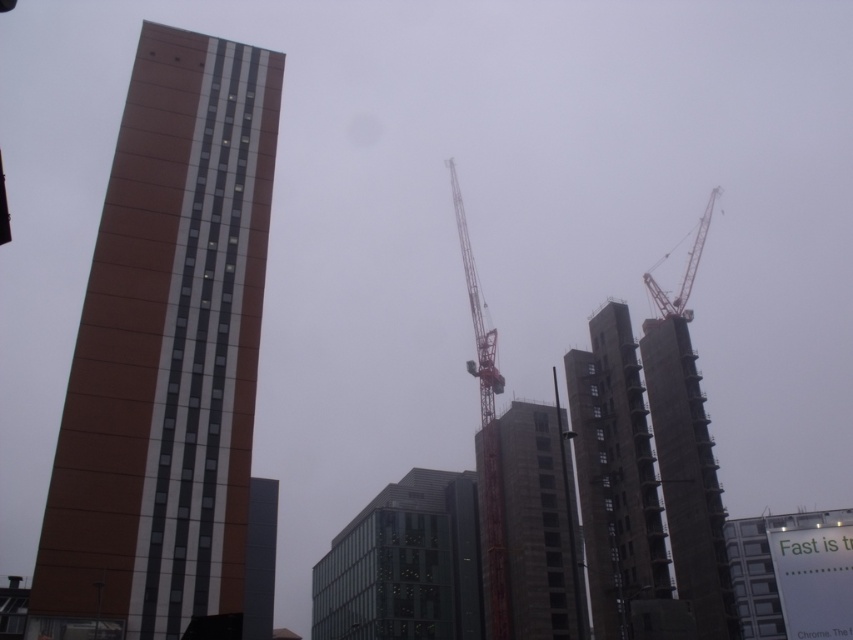
Question: Among these points, which one is nearest to the camera?

Choices:
 (A) (621, 358)
 (B) (646, 273)
 (C) (491, 609)
 (D) (515, 420)

Answer: (A)

Question: Can you confirm if dark gray concrete building at center is positioned to the right of orange metallic crane at upper right?

Choices:
 (A) yes
 (B) no

Answer: (B)

Question: Does brown textured building at left have a greater width compared to gray concrete building at center?

Choices:
 (A) yes
 (B) no

Answer: (B)

Question: Which object appears closest to the camera in this image?

Choices:
 (A) metallic gray crane at center
 (B) dark gray concrete tower at center
 (C) transparent glass building at center

Answer: (B)

Question: Is the position of dark gray concrete building at center less distant than that of gray concrete building at center?

Choices:
 (A) no
 (B) yes

Answer: (B)

Question: Which of the following is the closest to the observer?

Choices:
 (A) concrete scaffolding at right
 (B) transparent glass building at center

Answer: (A)